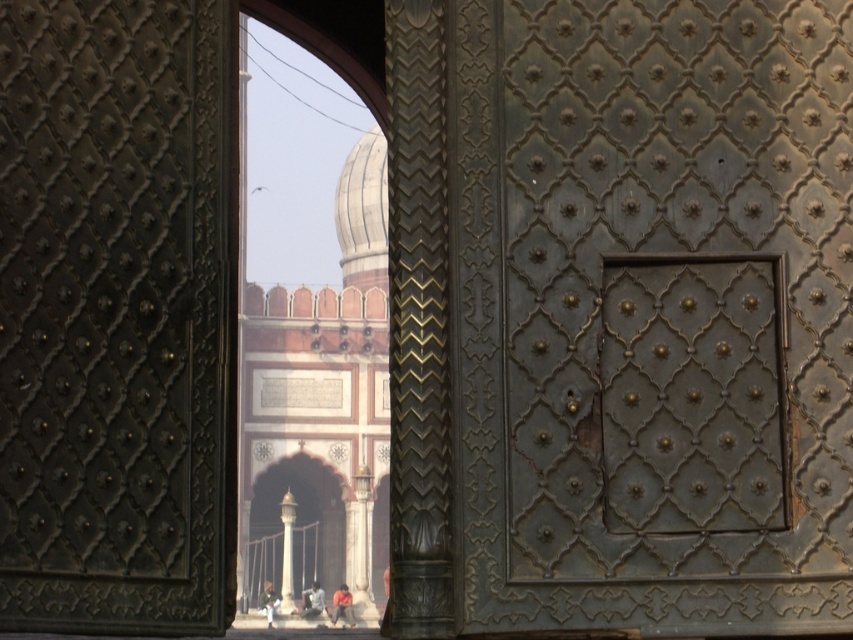
You are standing in front of a metalwork structure with a dark gray metal door at center. If you want to enter through the door, which direction should you move relative to your current position?

Since the dark gray metal door at center is positioned at point 0.492 on the x axis and 0.766 on the y axis, you should move forward towards the center of the structure to reach the door.

You are standing in front of the metalwork structure looking at the dome. There are two points marked on the metalwork. The first point is at coordinate point (820, 476) and the second is at point (331, 292). Which of these points is closer to you as you face the metalwork?

Point (820, 476) is in front of point (331, 292), so it is closer to you as you face the metalwork.

You are standing in front of the metalwork structure and see the dark gray metal door at center and the light brown leather jacket at center. Which object is closer to you?

The dark gray metal door at center is positioned over the light brown leather jacket at center, so the dark gray metal door at center is closer to you.